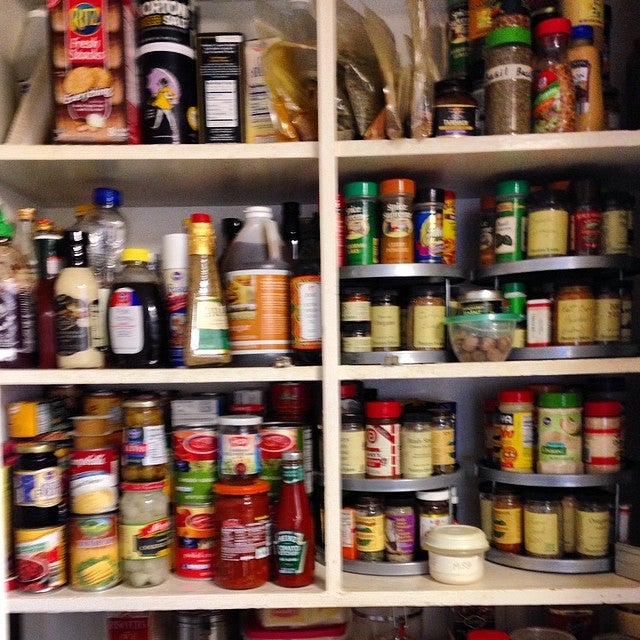
In order to click on glass jars in this screenshot , I will do click(x=156, y=544), click(x=140, y=436), click(x=38, y=498), click(x=228, y=539), click(x=297, y=543), click(x=511, y=536), click(x=397, y=547), click(x=202, y=345), click(x=81, y=290), click(x=454, y=105).